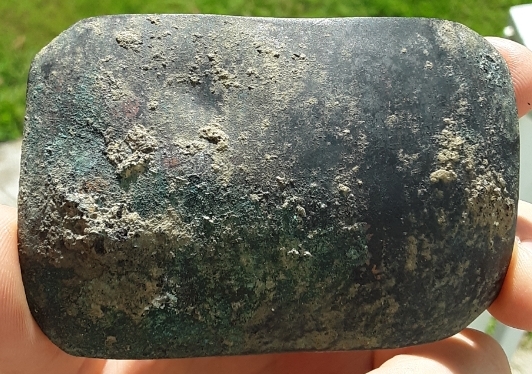
The image size is (532, 374). I want to click on table, so click(x=523, y=28).